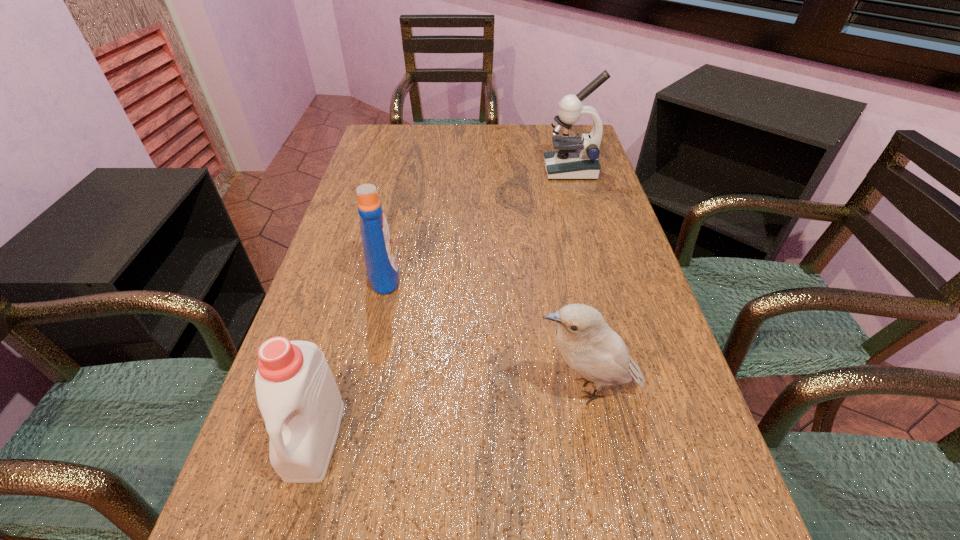
Where is `vacant space in between the nearer detergent and the farthest object`? The height and width of the screenshot is (540, 960). vacant space in between the nearer detergent and the farthest object is located at coordinates (443, 304).

Select which object is the closest to the third nearest object. Please provide its 2D coordinates. Your answer should be formatted as a tuple, i.e. [(x, y)], where the tuple contains the x and y coordinates of a point satisfying the conditions above.

[(297, 395)]

What are the coordinates of `the closest object to the nearer detergent` in the screenshot? It's located at (382, 270).

This screenshot has height=540, width=960. Find the location of `free location that satisfies the following two spatial constraints: 1. at the eyepiece of the farthest object; 2. on the handle side of the nearer detergent`. free location that satisfies the following two spatial constraints: 1. at the eyepiece of the farthest object; 2. on the handle side of the nearer detergent is located at coordinates (646, 438).

I want to click on free location that satisfies the following two spatial constraints: 1. at the beak of the bird; 2. on the handle side of the nearer detergent, so click(597, 438).

Where is `blank space that satisfies the following two spatial constraints: 1. on the label of the second farthest object; 2. on the handle side of the nearer detergent`? This screenshot has height=540, width=960. blank space that satisfies the following two spatial constraints: 1. on the label of the second farthest object; 2. on the handle side of the nearer detergent is located at coordinates (348, 438).

Locate an element on the screen. The height and width of the screenshot is (540, 960). vacant space that satisfies the following two spatial constraints: 1. at the beak of the bird; 2. on the handle side of the nearer detergent is located at coordinates (597, 438).